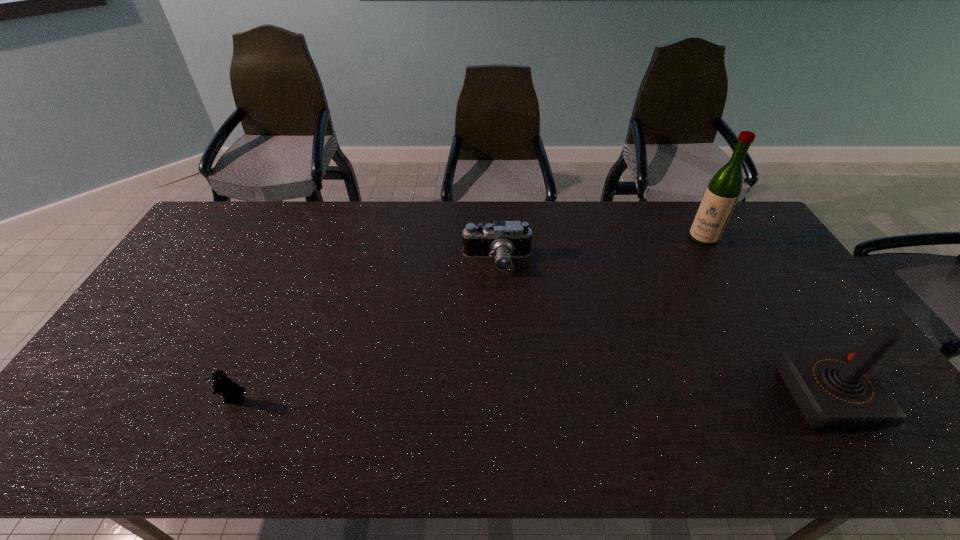
Image resolution: width=960 pixels, height=540 pixels. In order to click on the leftmost object in this screenshot , I will do `click(232, 393)`.

The height and width of the screenshot is (540, 960). Identify the location of the second tallest object. [x=835, y=390].

I want to click on the farthest object, so click(x=723, y=191).

Where is `the tallest object`? the tallest object is located at coordinates (723, 191).

Locate an element on the screen. This screenshot has width=960, height=540. the third object from right to left is located at coordinates (505, 240).

Identify the location of the second farthest object. (505, 240).

Identify the location of vacant point located 0.090m on the rectangular base of the second tallest object. (753, 398).

You are a GUI agent. You are given a task and a screenshot of the screen. Output one action in this format:
    pyautogui.click(x=<x>, y=<y>)
    Task: Click on the vacant region located on the rectangular base of the second tallest object
    This screenshot has height=540, width=960.
    Given the screenshot: What is the action you would take?
    pyautogui.click(x=688, y=398)

Where is `free space located 0.310m on the rectangular base of the second tallest object`? The width and height of the screenshot is (960, 540). free space located 0.310m on the rectangular base of the second tallest object is located at coordinates (664, 398).

Locate an element on the screen. free space located 0.240m on the label of the tallest object is located at coordinates (670, 283).